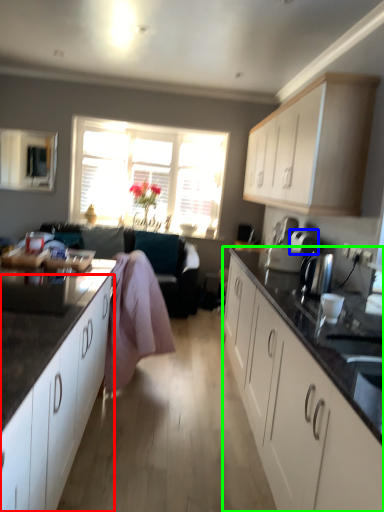
Question: Which is nearer to the cabinetry (highlighted by a red box)? appliance (highlighted by a blue box) or cabinetry (highlighted by a green box).

Choices:
 (A) appliance
 (B) cabinetry

Answer: (B)